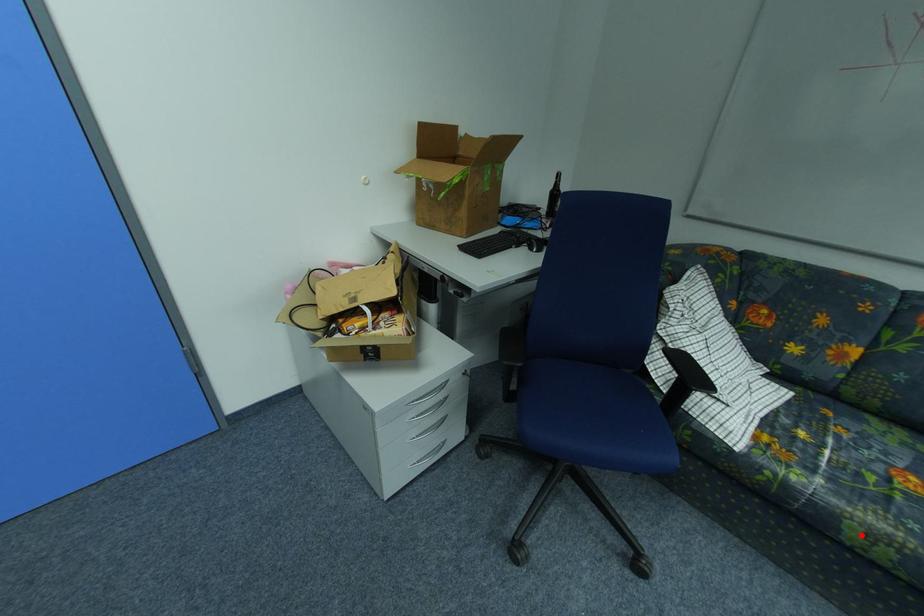
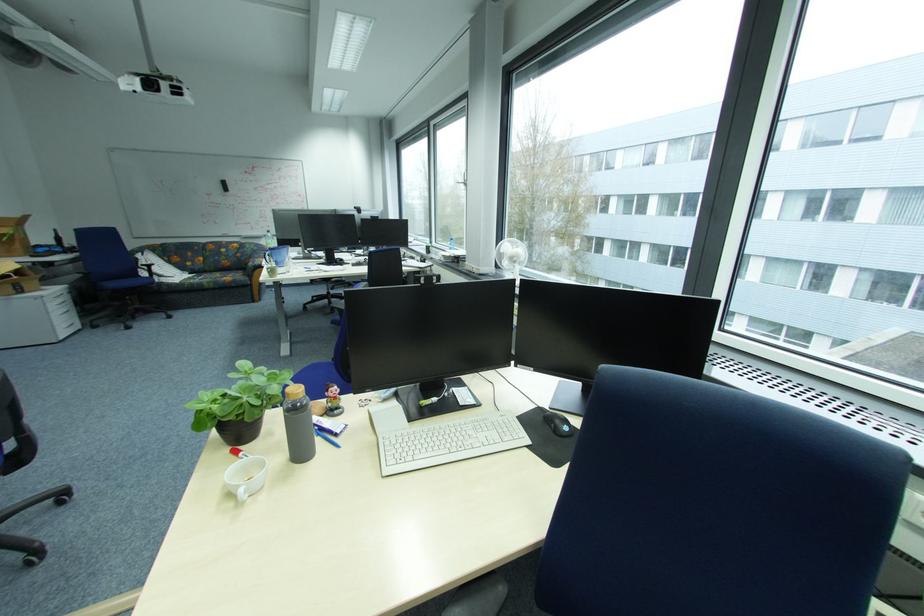
Question: I am providing you with two images of the same scene from different viewpoints. A red point is shown in image1. For the corresponding object point in image2, is it positioned nearer or farther from the camera?

Choices:
 (A) Nearer
 (B) Farther

Answer: (A)